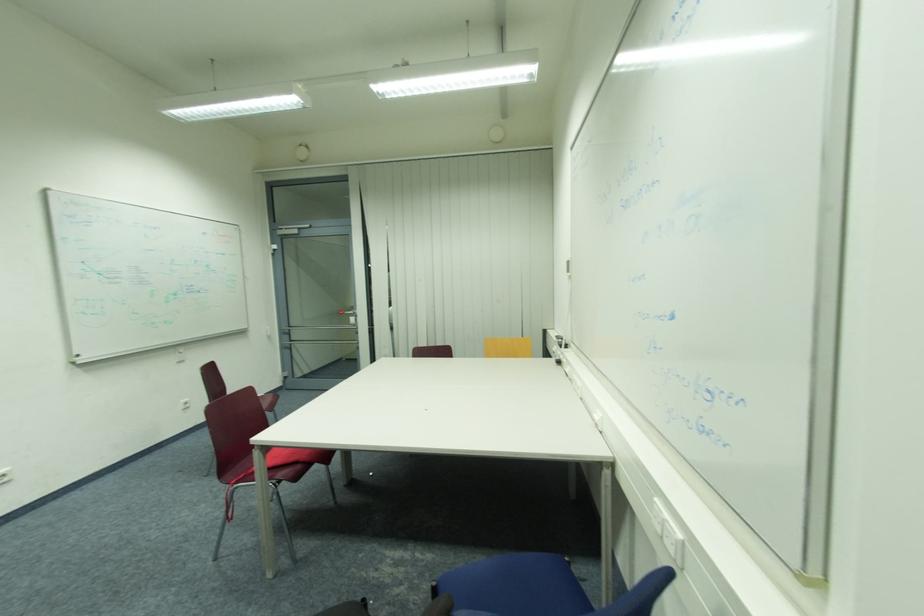
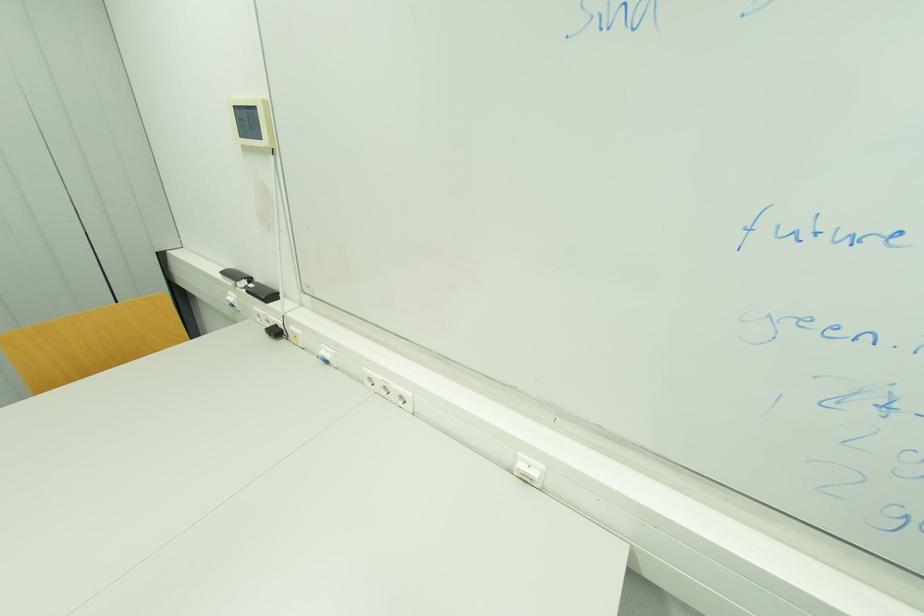
Locate, in the second image, the point that corresponds to point 563,363 in the first image.

(281, 333)